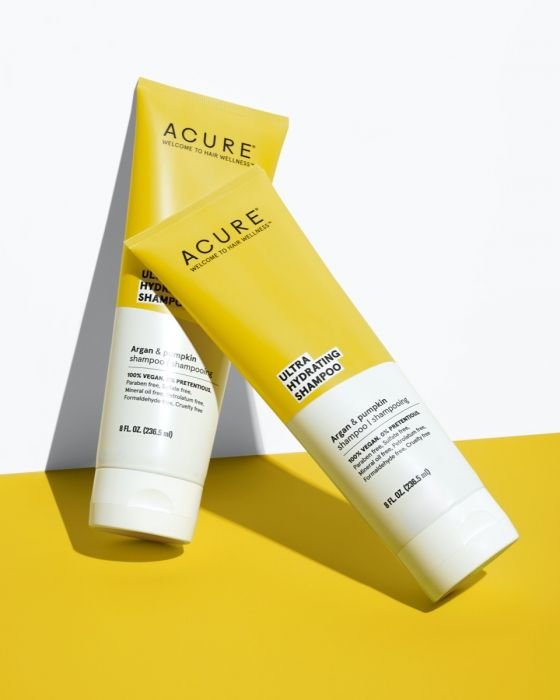
Locate an element on the screen. The image size is (560, 700). white wall is located at coordinates [476, 400].